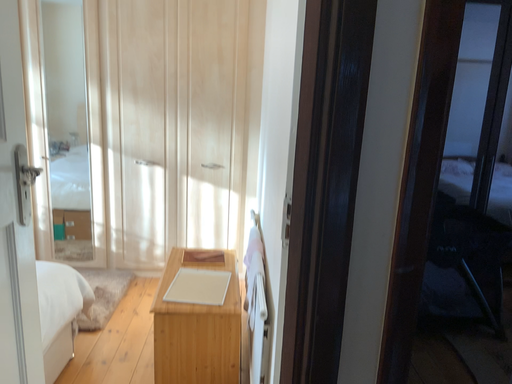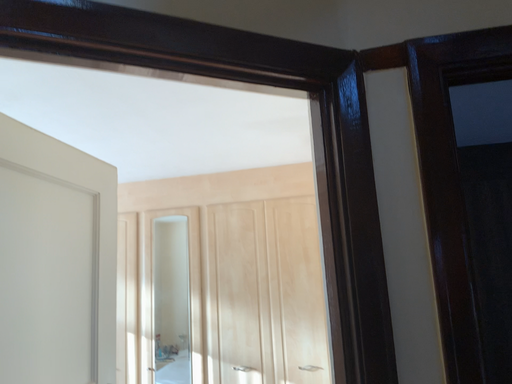
Question: Which way did the camera rotate in the video?

Choices:
 (A) rotated left
 (B) rotated right

Answer: (A)